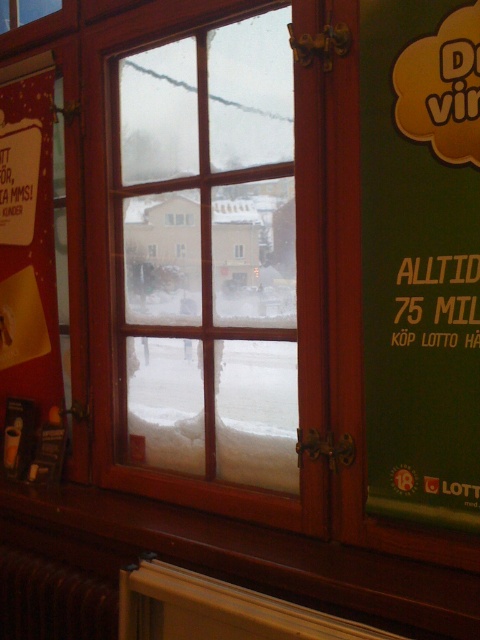
You are standing in a room with a window and a red bulletin board. You need to place a new notice on the bulletin board. The existing matte red poster at left is located at coordinates approximately 0.439 on the x and 0.060 on the y. Where should you place the new notice so it doesn not overlap with the existing poster?

Place the new notice either to the right of the matte red poster at left, below it, or above it, ensuring it stays within the bulletin board area but avoids the coordinates around (28, 280) where the existing poster is located.

You are standing in a room and want to reach the brown metallic radiator at lower left to adjust its temperature. However, the wooden window at center is blocking your path. Can you move around the window to access the radiator?

The wooden window at center is in front of the brown metallic radiator at lower left, meaning the radiator is behind the window. Since the window is part of the wall, you cannot move around it to access the radiator directly. You would need to approach the radiator from another angle or path that isn not obstructed by the window.